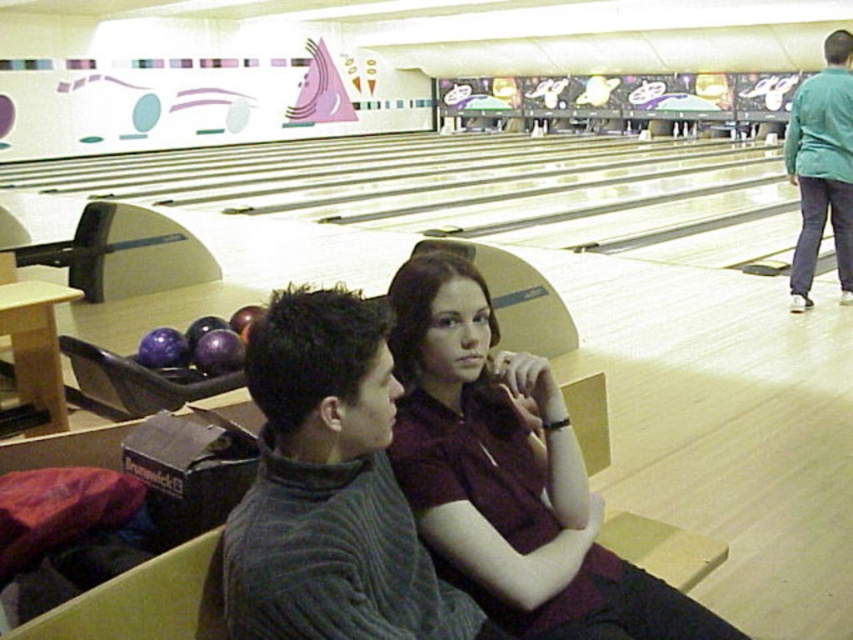
Question: Which point appears closest to the camera in this image?

Choices:
 (A) (358, 481)
 (B) (164, 349)

Answer: (A)

Question: In this image, where is dark gray ribbed sweater at center located relative to purple matte bowling ball at left?

Choices:
 (A) right
 (B) left

Answer: (A)

Question: Estimate the real-world distances between objects in this image. Which object is closer to the dark gray ribbed sweater at center?

Choices:
 (A) maroon fabric shirt at center
 (B) purple matte bowling ball at left
 (C) green fabric shirt at upper right

Answer: (A)

Question: Is maroon fabric shirt at center above green fabric shirt at upper right?

Choices:
 (A) yes
 (B) no

Answer: (B)

Question: Is maroon fabric shirt at center wider than green fabric shirt at upper right?

Choices:
 (A) yes
 (B) no

Answer: (A)

Question: Which object is the closest to the green fabric shirt at upper right?

Choices:
 (A) dark gray ribbed sweater at center
 (B) purple matte bowling ball at left
 (C) maroon fabric shirt at center

Answer: (B)